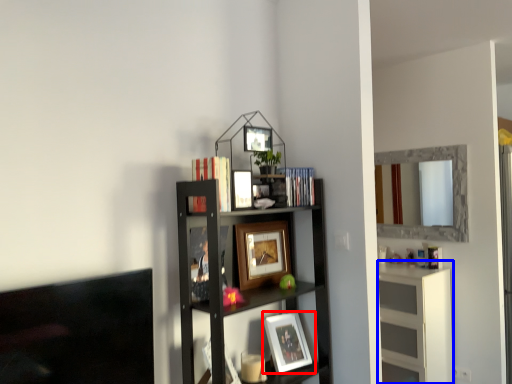
Question: Which object is further to the camera taking this photo, picture frame (highlighted by a red box) or cabinet (highlighted by a blue box)?

Choices:
 (A) picture frame
 (B) cabinet

Answer: (B)